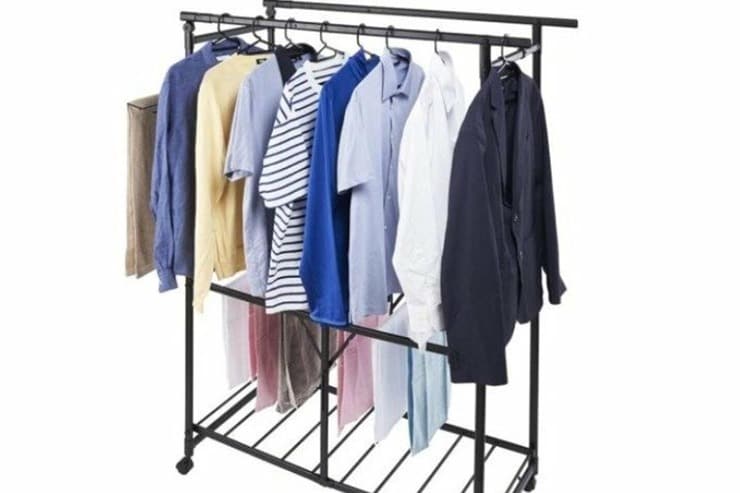
At what (x,y) coordinates should I click in order to perform the action: click on hanger hooks. Please return your answer as a coordinate pair (x, y). The height and width of the screenshot is (493, 740). Looking at the image, I should click on (504, 48), (437, 41), (388, 30), (357, 27), (319, 30), (283, 27), (252, 24), (218, 20).